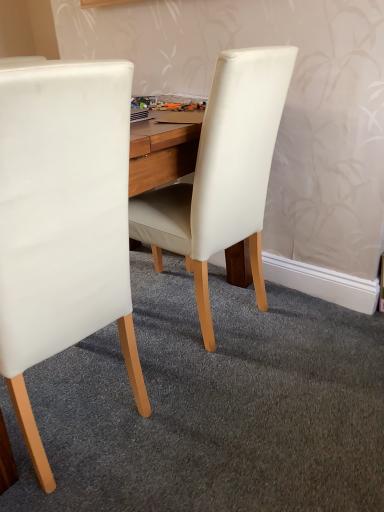
Question: Is white leather chair at left, marked as the 1th chair in a left-to-right arrangement, bigger than white leather chair at center, which ranks as the 2th chair in left-to-right order?

Choices:
 (A) yes
 (B) no

Answer: (A)

Question: Is white leather chair at left, the 2th chair when ordered from right to left, oriented towards white leather chair at center, which ranks as the 2th chair in left-to-right order?

Choices:
 (A) no
 (B) yes

Answer: (A)

Question: Is white leather chair at left, the 2th chair when ordered from right to left, shorter than white leather chair at center, the 1th chair viewed from the right?

Choices:
 (A) no
 (B) yes

Answer: (A)

Question: Can you confirm if white leather chair at left, the 2th chair when ordered from right to left, is positioned to the left of white leather chair at center, which ranks as the 2th chair in left-to-right order?

Choices:
 (A) no
 (B) yes

Answer: (B)

Question: From a real-world perspective, is white leather chair at left, the 2th chair when ordered from right to left, positioned under white leather chair at center, the 1th chair viewed from the right, based on gravity?

Choices:
 (A) no
 (B) yes

Answer: (A)

Question: From the image's perspective, does white leather chair at left, the 2th chair when ordered from right to left, appear higher than white leather chair at center, which ranks as the 2th chair in left-to-right order?

Choices:
 (A) no
 (B) yes

Answer: (A)

Question: Can you confirm if white leather chair at center, the 1th chair viewed from the right, is taller than white leather chair at left, marked as the 1th chair in a left-to-right arrangement?

Choices:
 (A) yes
 (B) no

Answer: (B)

Question: From the image's perspective, is white leather chair at center, the 1th chair viewed from the right, under white leather chair at left, the 2th chair when ordered from right to left?

Choices:
 (A) no
 (B) yes

Answer: (A)

Question: From a real-world perspective, does white leather chair at center, which ranks as the 2th chair in left-to-right order, stand above white leather chair at left, the 2th chair when ordered from right to left?

Choices:
 (A) no
 (B) yes

Answer: (A)

Question: Is white leather chair at center, the 1th chair viewed from the right, further to the viewer compared to white leather chair at left, the 2th chair when ordered from right to left?

Choices:
 (A) yes
 (B) no

Answer: (A)

Question: Can you confirm if white leather chair at center, which ranks as the 2th chair in left-to-right order, is smaller than white leather chair at left, the 2th chair when ordered from right to left?

Choices:
 (A) no
 (B) yes

Answer: (B)

Question: Is white leather chair at center, which ranks as the 2th chair in left-to-right order, far away from white leather chair at left, marked as the 1th chair in a left-to-right arrangement?

Choices:
 (A) yes
 (B) no

Answer: (B)

Question: Choose the correct answer: Is white leather chair at left, the 2th chair when ordered from right to left, inside white leather chair at center, the 1th chair viewed from the right, or outside it?

Choices:
 (A) outside
 (B) inside

Answer: (A)